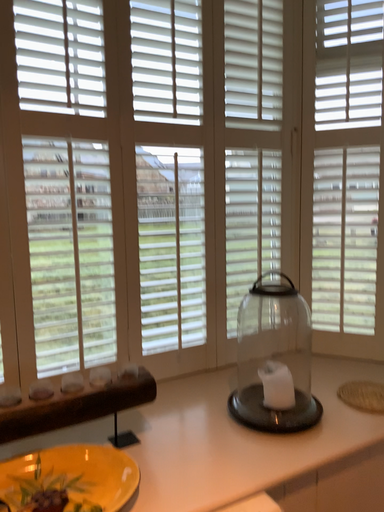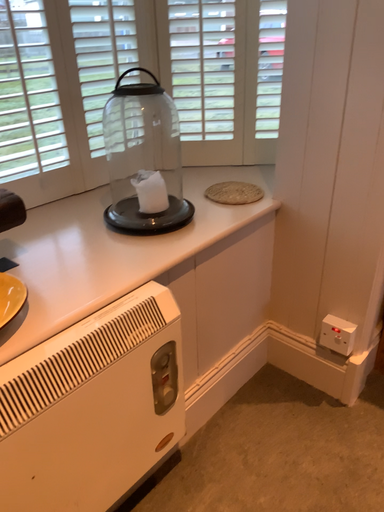
Question: How did the camera likely rotate when shooting the video?

Choices:
 (A) rotated left
 (B) rotated right

Answer: (B)